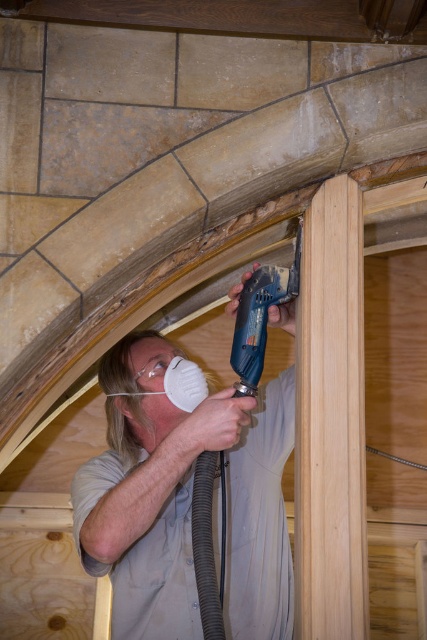
You are a construction worker in the attic and need to use the matte blue drill at center and the blue plastic drill at center. Which one is closer to your right hand if you are facing the tools?

The blue plastic drill at center is closer to your right hand because the matte blue drill at center is to the left of it.

You are a construction worker who needs to choose between the matte blue drill at center and the blue plastic drill at center based on their sizes. Which drill is taller?

The matte blue drill at center is taller than the blue plastic drill at center.